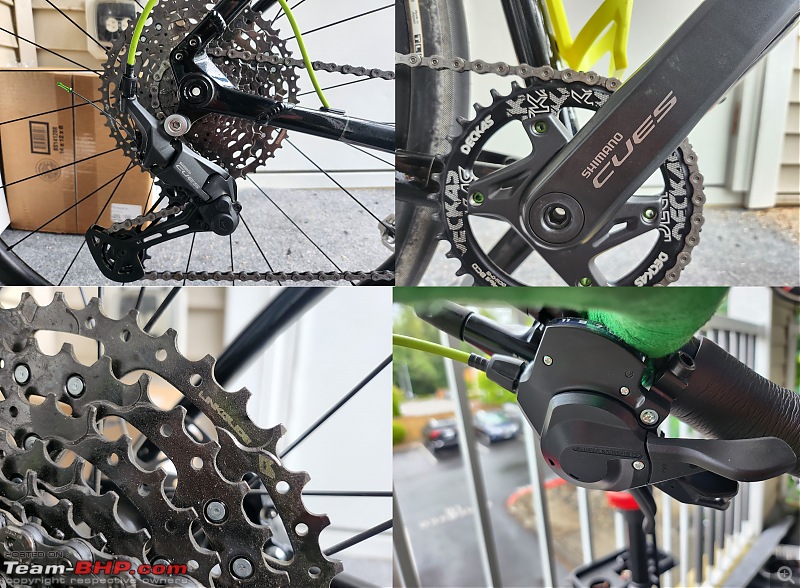
Where is `windows`? The width and height of the screenshot is (800, 588). windows is located at coordinates (196, 330), (142, 306).